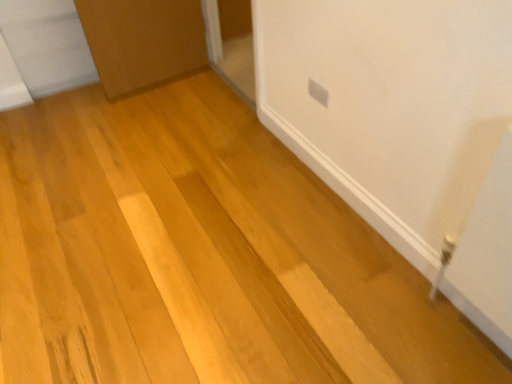
Question: Should I look upward or downward to see white glossy door at upper center?

Choices:
 (A) up
 (B) down

Answer: (A)